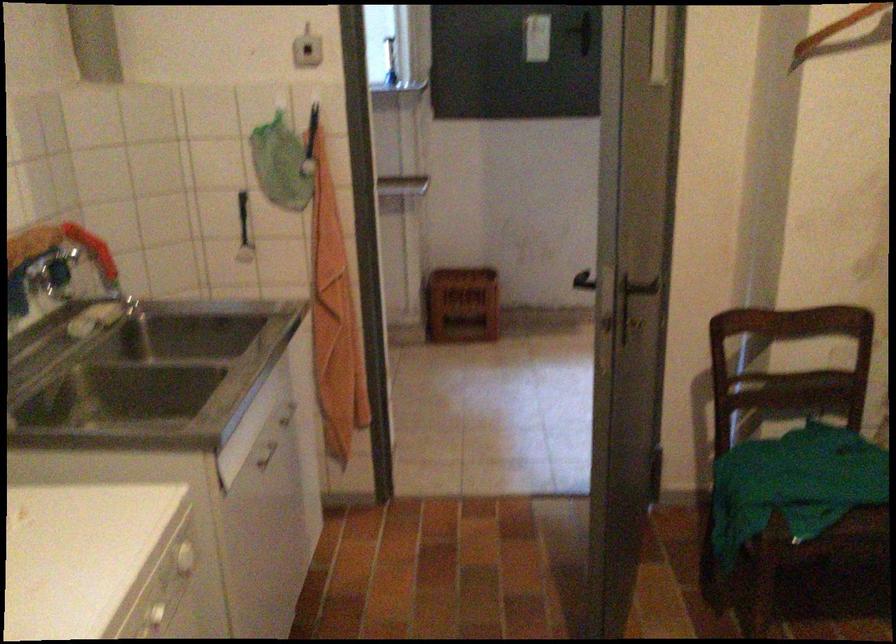
At what (x,y) coordinates should I click in order to perform the action: click on red faucet handle. Please return your answer as a coordinate pair (x, y). The image size is (896, 644). Looking at the image, I should click on (91, 249).